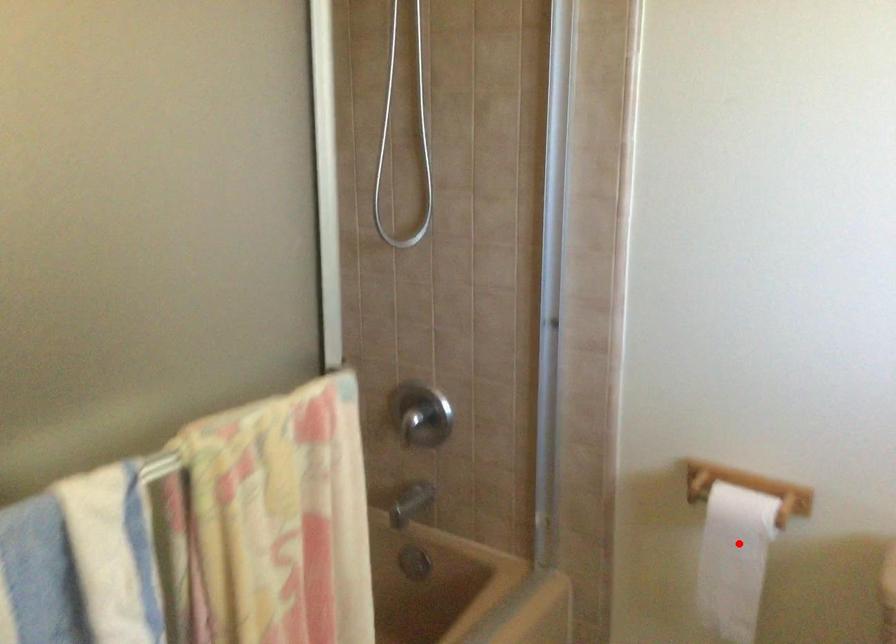
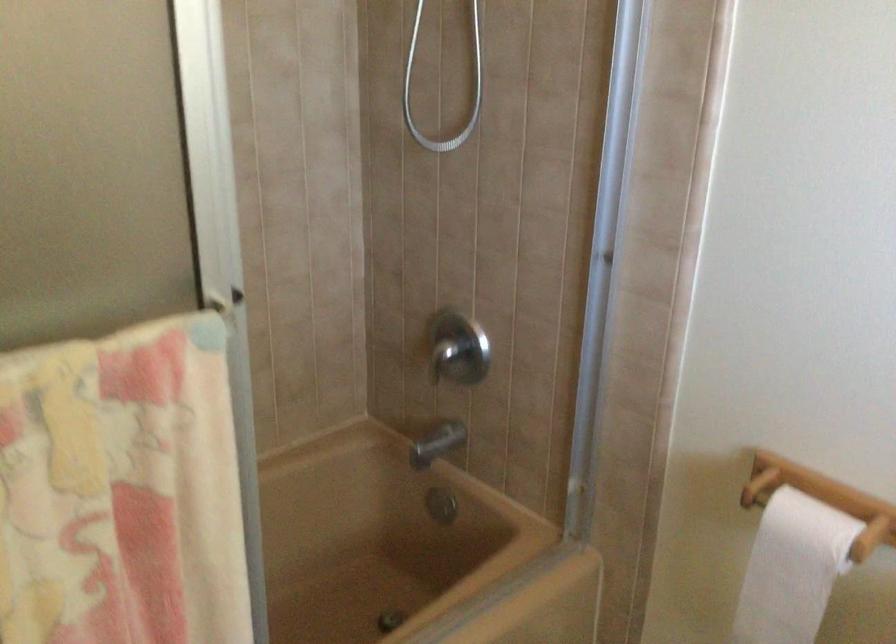
Question: I am providing you with two images of the same scene from different viewpoints. Given a red point in image1, look at the same physical point in image2. Is it:

Choices:
 (A) Closer to the viewpoint
 (B) Farther from the viewpoint

Answer: (A)